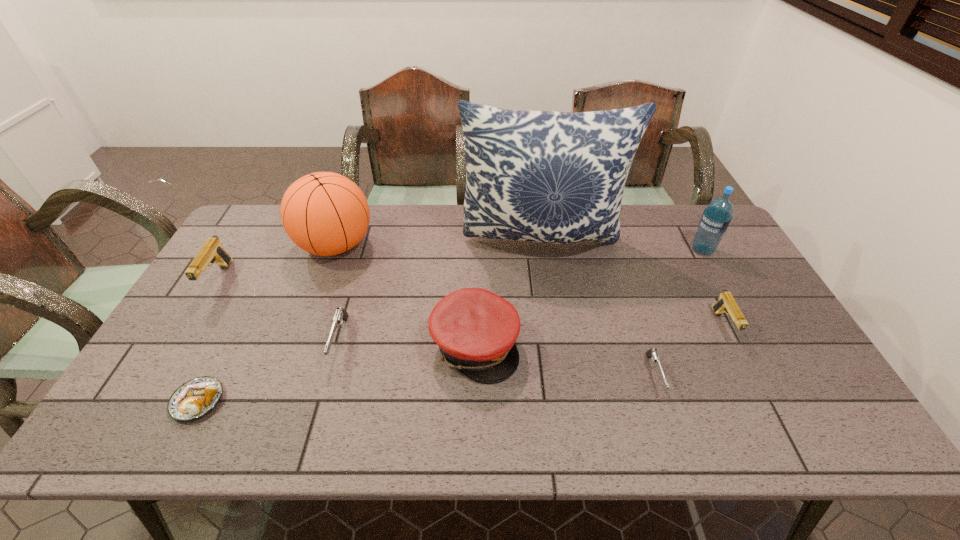
Where is `vacant space that's between the cushion and the basketball`? vacant space that's between the cushion and the basketball is located at coordinates (439, 242).

Locate an element on the screen. This screenshot has width=960, height=540. unoccupied area between the cushion and the left silver pistol is located at coordinates pyautogui.click(x=441, y=290).

Find the location of a particular element. The height and width of the screenshot is (540, 960). free space between the second object from right to left and the left silver pistol is located at coordinates (531, 333).

This screenshot has height=540, width=960. Identify the location of free space between the cushion and the shortest object. (370, 320).

Where is `unoccupied area between the rightmost pistol and the second shortest pistol`? The image size is (960, 540). unoccupied area between the rightmost pistol and the second shortest pistol is located at coordinates pos(531,333).

Locate an element on the screen. Image resolution: width=960 pixels, height=540 pixels. blank region between the cap and the right tan pistol is located at coordinates (599, 336).

Locate an element on the screen. Image resolution: width=960 pixels, height=540 pixels. the fourth closest object to the cap is located at coordinates (652, 353).

Choose which object is the eighth nearest neighbor to the smaller silver pistol. Please provide its 2D coordinates. Your answer should be formatted as a tuple, i.e. [(x, y)], where the tuple contains the x and y coordinates of a point satisfying the conditions above.

[(212, 251)]

Identify which pistol is located as the third nearest to the pastry. Please provide its 2D coordinates. Your answer should be formatted as a tuple, i.e. [(x, y)], where the tuple contains the x and y coordinates of a point satisfying the conditions above.

[(652, 353)]

Locate which pistol is the second closest to the bigger tan pistol. Please provide its 2D coordinates. Your answer should be formatted as a tuple, i.e. [(x, y)], where the tuple contains the x and y coordinates of a point satisfying the conditions above.

[(652, 353)]